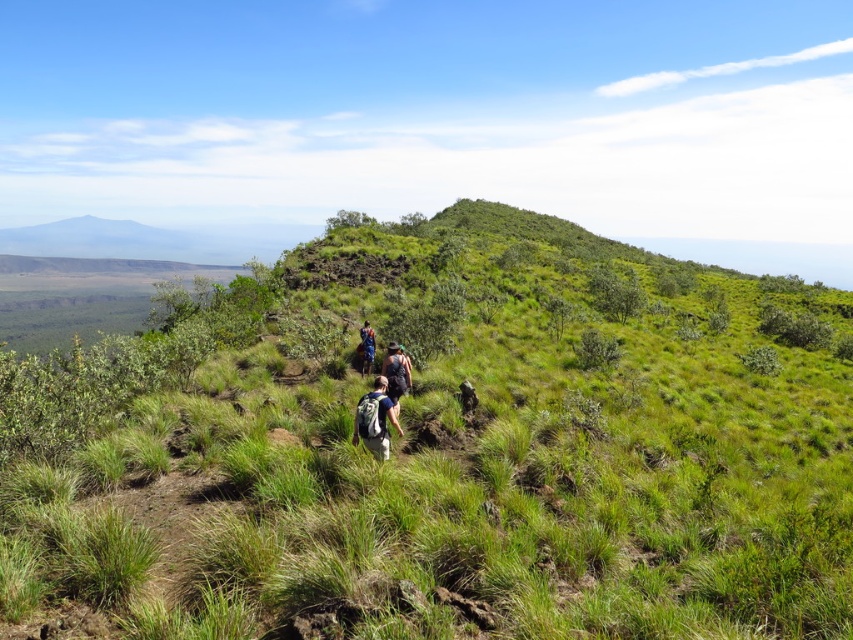
Question: Does dark blue backpack at center appear on the left side of blue fabric backpack at center?

Choices:
 (A) yes
 (B) no

Answer: (B)

Question: Does green grassy at center have a larger size compared to blue fabric backpack at center?

Choices:
 (A) yes
 (B) no

Answer: (A)

Question: Among these objects, which one is farthest from the camera?

Choices:
 (A) green grassy at center
 (B) blue fabric backpack at center
 (C) matte blue backpack at center

Answer: (B)

Question: Among these objects, which one is nearest to the camera?

Choices:
 (A) dark blue backpack at center
 (B) matte blue backpack at center
 (C) blue fabric backpack at center
 (D) green grassy at center

Answer: (D)

Question: Can you confirm if green grassy at center is positioned to the left of dark blue backpack at center?

Choices:
 (A) no
 (B) yes

Answer: (A)

Question: Which object appears farthest from the camera in this image?

Choices:
 (A) matte blue backpack at center
 (B) dark blue backpack at center
 (C) green grassy at center

Answer: (B)